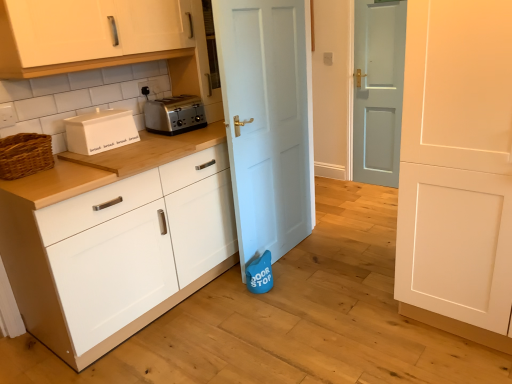
Locate an element on the screen. The height and width of the screenshot is (384, 512). free spot in front of light blue matte door at center, the 2th door positioned from the back is located at coordinates (294, 289).